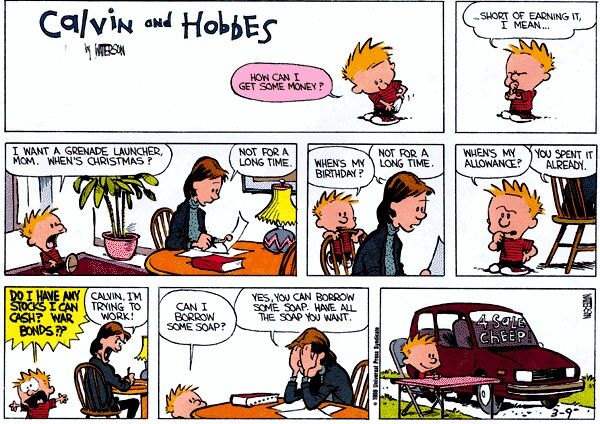
Image resolution: width=600 pixels, height=424 pixels. I want to click on chairs, so pos(102,384), pos(162,210), pos(287,259), pos(341,242), pos(572,195), pos(398,354).